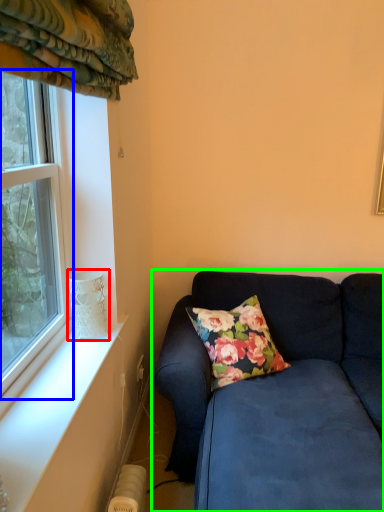
Question: Which object is positioned farthest from glass vase (highlighted by a red box)? Select from window (highlighted by a blue box) and studio couch (highlighted by a green box).

Choices:
 (A) window
 (B) studio couch

Answer: (B)